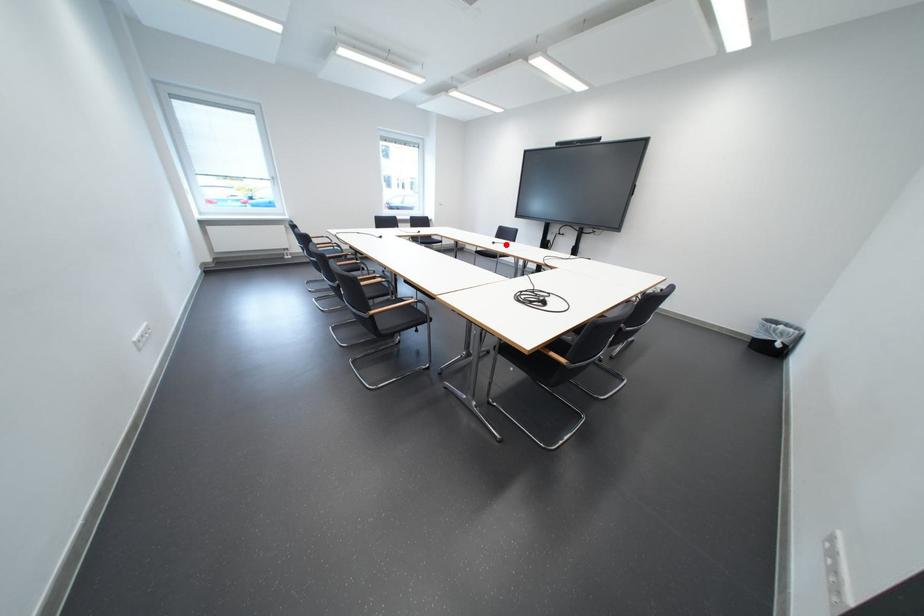
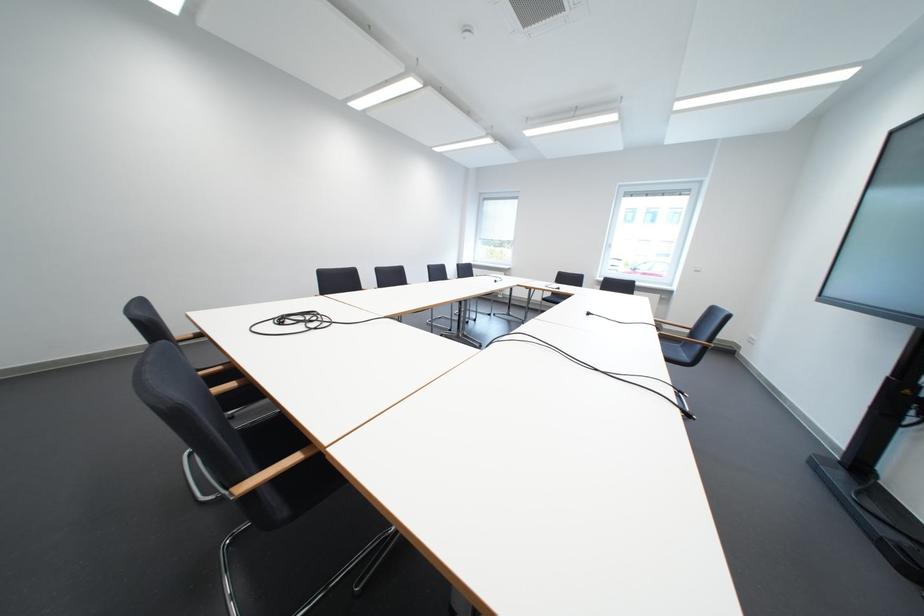
Question: I am providing you with two images of the same scene from different viewpoints. In image1, a red point is highlighted. Considering the same 3D point in image2, which of the following is correct?

Choices:
 (A) It is closer
 (B) It is farther

Answer: (B)